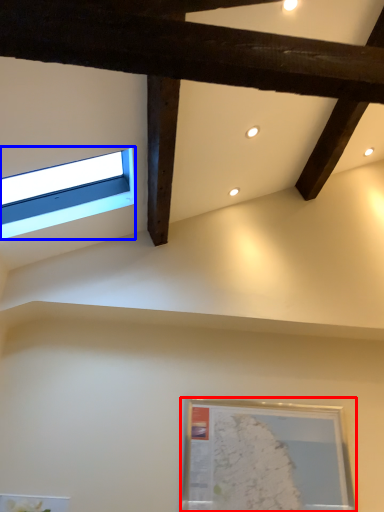
Question: Which point is closer to the camera, picture frame (highlighted by a red box) or window (highlighted by a blue box)?

Choices:
 (A) picture frame
 (B) window

Answer: (B)